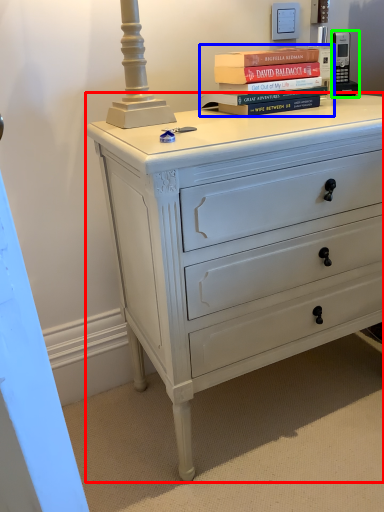
Question: Based on their relative distances, which object is farther from chest of drawers (highlighted by a red box)? Choose from book (highlighted by a blue box) and gadget (highlighted by a green box).

Choices:
 (A) book
 (B) gadget

Answer: (B)